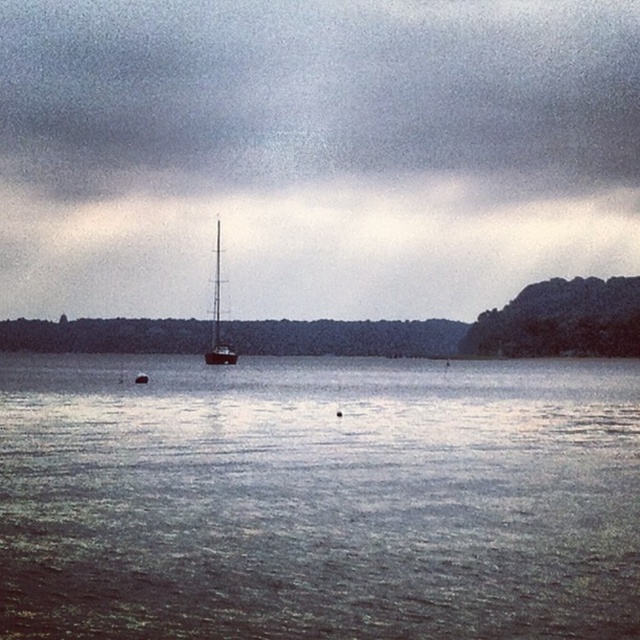
Does point (554, 365) come closer to viewer compared to point (220, 342)?

That is True.

Between gray reflective water at center and metallic silver mast at center, which one appears on the right side from the viewer's perspective?

Positioned to the right is gray reflective water at center.

Between point (51, 419) and point (218, 243), which one is positioned in front?

Point (51, 419) is more forward.

Identify the location of gray reflective water at center. (317, 499).